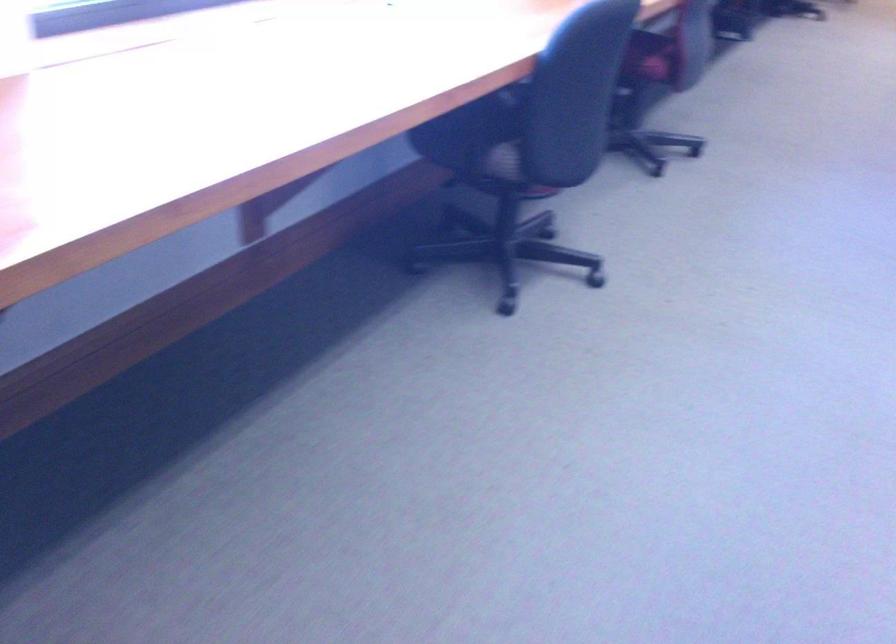
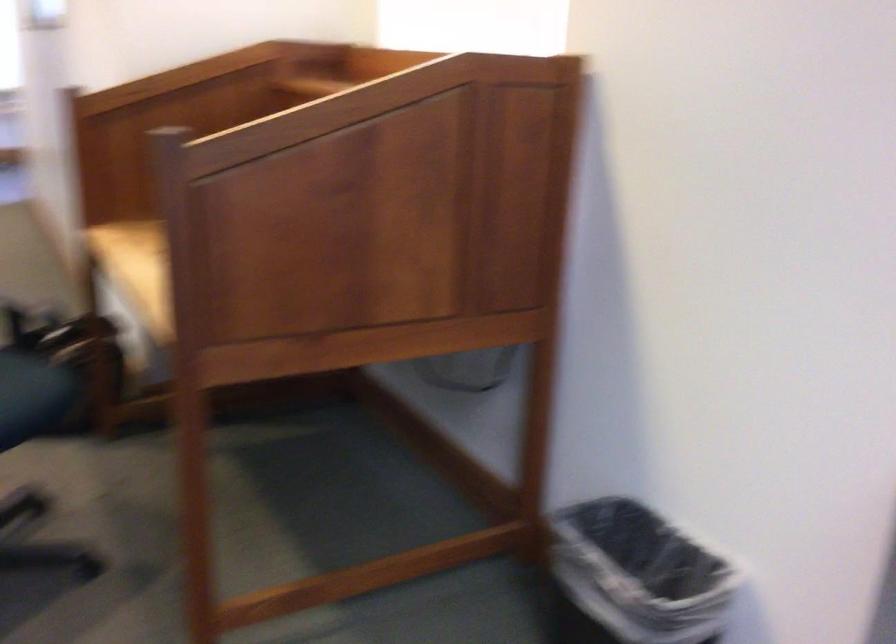
The first image is from the beginning of the video and the second image is from the end. How did the camera likely rotate when shooting the video?

The camera's rotation is toward left-down.